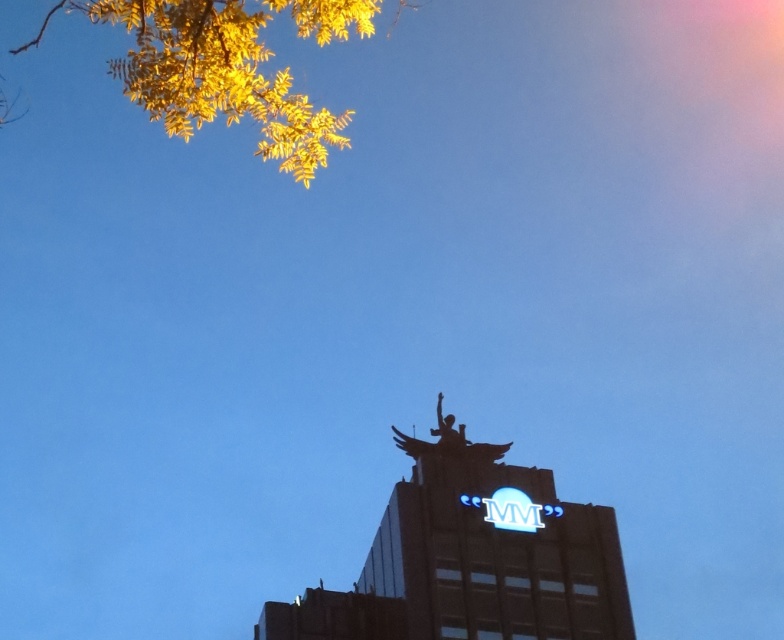
Question: Is metallic statue at center thinner than yellow leafy branches at upper left?

Choices:
 (A) no
 (B) yes

Answer: (B)

Question: Which object appears closest to the camera in this image?

Choices:
 (A) yellow leafy branches at upper left
 (B) metallic statue at center

Answer: (A)

Question: Which point appears farthest from the camera in this image?

Choices:
 (A) (532, 609)
 (B) (184, 48)

Answer: (A)

Question: Among these points, which one is farthest from the camera?

Choices:
 (A) (253, 97)
 (B) (416, 536)

Answer: (B)

Question: Does metallic statue at center have a lesser width compared to yellow leafy branches at upper left?

Choices:
 (A) no
 (B) yes

Answer: (B)

Question: Where is metallic statue at center located in relation to yellow leafy branches at upper left in the image?

Choices:
 (A) left
 (B) right

Answer: (B)